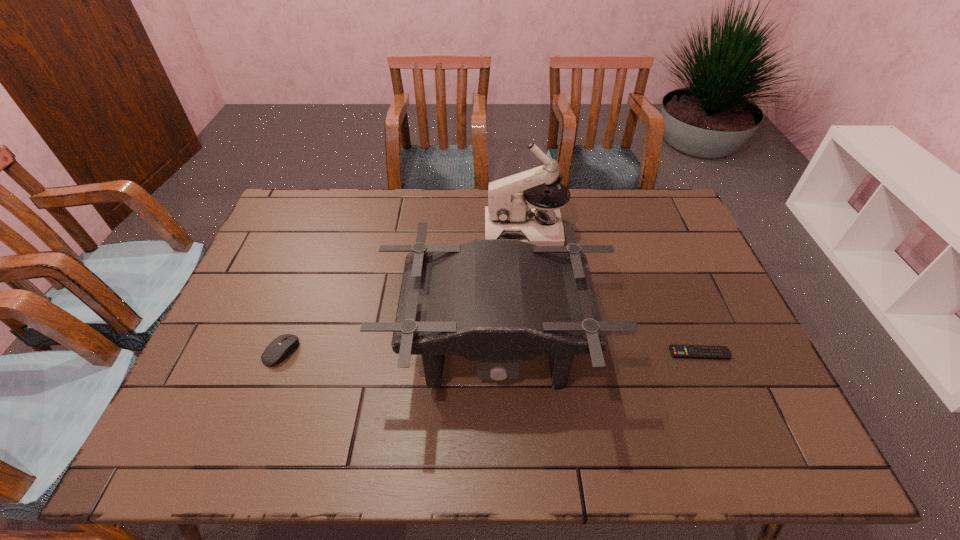
This screenshot has height=540, width=960. Identify the location of microscope. point(509,215).

In order to click on the farthest object in this screenshot , I will do `click(509, 215)`.

You are a GUI agent. You are given a task and a screenshot of the screen. Output one action in this format:
    pyautogui.click(x=<x>, y=<y>)
    Task: Click on the third shortest object
    This screenshot has width=960, height=540.
    Given the screenshot: What is the action you would take?
    pyautogui.click(x=496, y=301)

Identify the location of the third tallest object. The image size is (960, 540). (283, 346).

Locate an element on the screen. the leftmost object is located at coordinates (283, 346).

Locate an element on the screen. This screenshot has width=960, height=540. remote control is located at coordinates (677, 351).

The image size is (960, 540). Find the location of `the rightmost object`. the rightmost object is located at coordinates (677, 351).

Locate an element on the screen. vacant area situated 0.050m at the eyepiece of the microscope is located at coordinates (470, 231).

Locate an element on the screen. This screenshot has height=540, width=960. vacant area situated 0.090m at the eyepiece of the microscope is located at coordinates click(x=458, y=231).

What are the coordinates of `free space located 0.260m at the eyepiece of the microscope` in the screenshot? It's located at (407, 231).